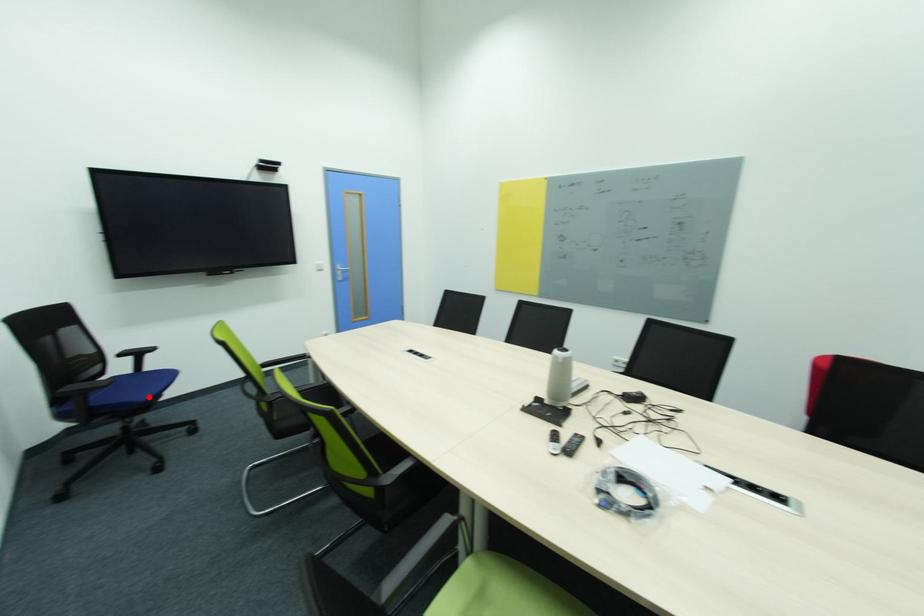
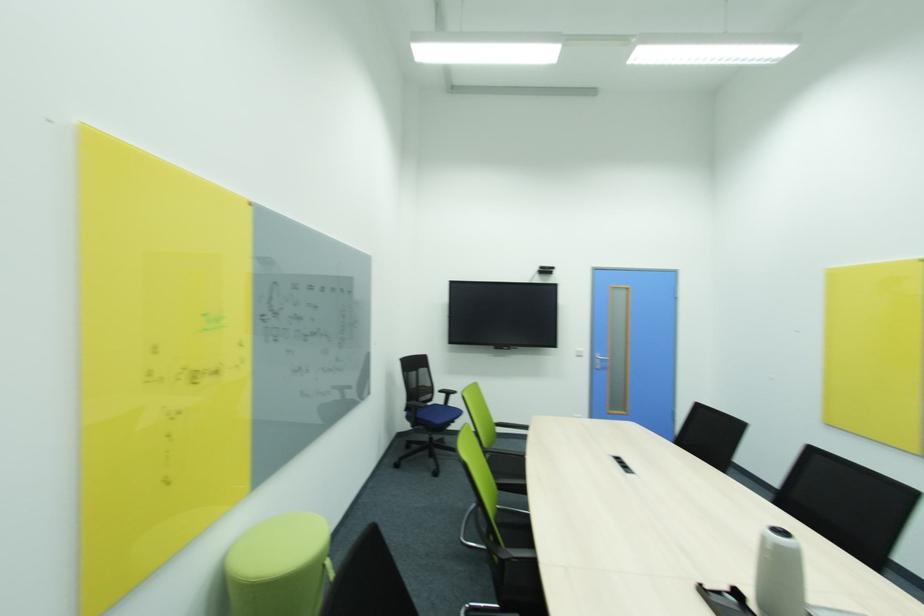
Question: I am providing you with two images of the same scene from different viewpoints. In image1, a red point is highlighted. Considering the same 3D point in image2, which of the following is correct?

Choices:
 (A) It is closer
 (B) It is farther

Answer: (B)